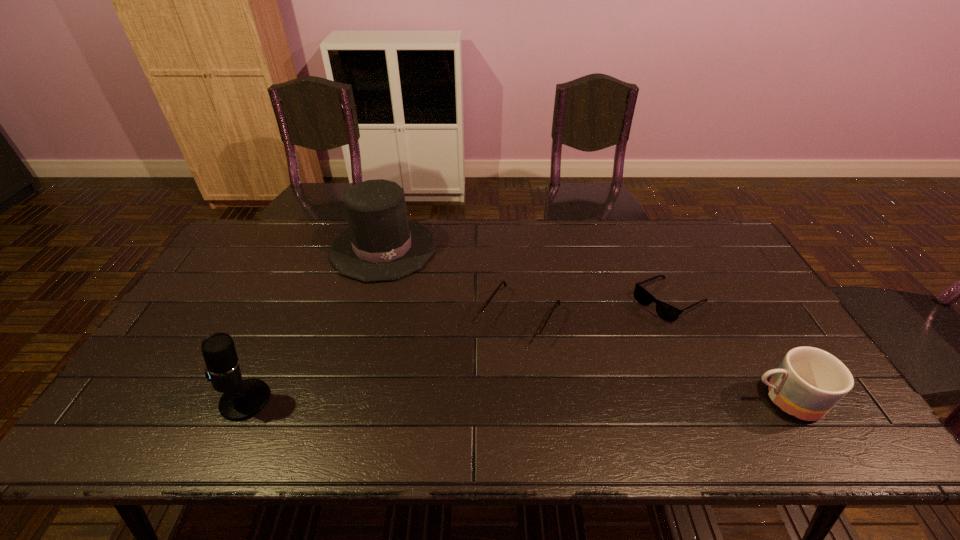
At what (x,y) coordinates should I click in order to perform the action: click on mug that is at the near edge. Please return your answer as a coordinate pair (x, y). The image size is (960, 540). Looking at the image, I should click on (809, 382).

Identify the location of object that is at the right edge. The width and height of the screenshot is (960, 540). (809, 382).

Locate an element on the screen. The height and width of the screenshot is (540, 960). object present at the near right corner is located at coordinates (809, 382).

You are a GUI agent. You are given a task and a screenshot of the screen. Output one action in this format:
    pyautogui.click(x=<x>, y=<y>)
    Task: Click on the free space at the far edge of the desktop
    Image resolution: width=960 pixels, height=540 pixels.
    Given the screenshot: What is the action you would take?
    pyautogui.click(x=597, y=232)

Where is `free location at the near edge`? This screenshot has height=540, width=960. free location at the near edge is located at coordinates (335, 407).

I want to click on vacant space at the left edge of the desktop, so click(200, 330).

In the image, there is a desktop. At what (x,y) coordinates should I click in order to perform the action: click on vacant space at the right edge. Please return your answer as a coordinate pair (x, y). The height and width of the screenshot is (540, 960). Looking at the image, I should click on (701, 271).

Where is `free location at the far left corner of the desktop`? Image resolution: width=960 pixels, height=540 pixels. free location at the far left corner of the desktop is located at coordinates (253, 244).

The width and height of the screenshot is (960, 540). I want to click on vacant space at the far right corner, so click(686, 230).

The width and height of the screenshot is (960, 540). I want to click on vacant area that lies between the spectacles and the leftmost object, so click(383, 358).